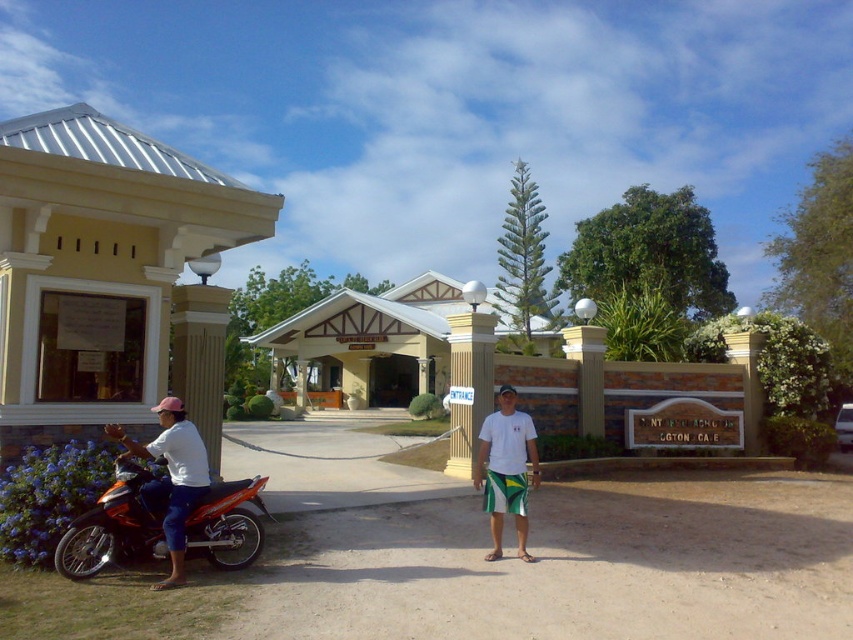
Which of these two, yellow matte building at center or shiny orange motorcycle at left, stands shorter?

shiny orange motorcycle at left is shorter.

Can you confirm if yellow matte building at center is bigger than shiny orange motorcycle at left?

Indeed, yellow matte building at center has a larger size compared to shiny orange motorcycle at left.

Does point (439, 332) come farther from viewer compared to point (136, 554)?

Yes, it is behind point (136, 554).

Locate an element on the screen. This screenshot has width=853, height=640. yellow matte building at center is located at coordinates (369, 340).

Can you confirm if yellow matte building at center is taller than white cotton shirt at left?

Indeed, yellow matte building at center has a greater height compared to white cotton shirt at left.

Can you confirm if yellow matte building at center is positioned to the right of white cotton shirt at left?

Indeed, yellow matte building at center is positioned on the right side of white cotton shirt at left.

The height and width of the screenshot is (640, 853). In order to click on yellow matte building at center in this screenshot , I will do `click(369, 340)`.

This screenshot has width=853, height=640. Identify the location of yellow matte building at center. (369, 340).

Which of these two, beige concrete kiosk at left or white cotton t-shirt at center, stands shorter?

white cotton t-shirt at center

Identify the location of beige concrete kiosk at left. point(97,266).

Describe the element at coordinates (97, 266) in the screenshot. I see `beige concrete kiosk at left` at that location.

Locate an element on the screen. The height and width of the screenshot is (640, 853). beige concrete kiosk at left is located at coordinates (97, 266).